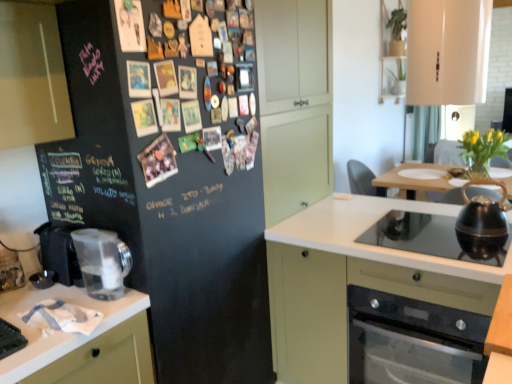
What do you see at coordinates (423, 236) in the screenshot?
I see `black glass cooktop at lower right` at bounding box center [423, 236].

Find the location of a particular element. The width and height of the screenshot is (512, 384). shiny black kettle at right, which appears as the first kitchen appliance when viewed from the right is located at coordinates (x=482, y=223).

Locate an element on the screen. This screenshot has width=512, height=384. black matte refrigerator at left is located at coordinates pos(167,191).

Image resolution: width=512 pixels, height=384 pixels. Describe the element at coordinates (167, 191) in the screenshot. I see `black matte refrigerator at left` at that location.

What do you see at coordinates (483, 148) in the screenshot? The height and width of the screenshot is (384, 512). I see `yellow matte vase at upper right` at bounding box center [483, 148].

Find the location of a particular element. wooden table at lower right is located at coordinates (500, 338).

Which object is wider, matte white cabinet at center, which appears as the second cabinetry when viewed from the top, or transparent plastic pitcher at left, marked as the first kitchen appliance in a front-to-back arrangement?

matte white cabinet at center, which appears as the second cabinetry when viewed from the top.

Is matte white cabinet at center, which appears as the second cabinetry when viewed from the top, oriented away from transparent plastic pitcher at left, marked as the first kitchen appliance in a front-to-back arrangement?

No, transparent plastic pitcher at left, marked as the first kitchen appliance in a front-to-back arrangement, is not at the back of matte white cabinet at center, which appears as the second cabinetry when viewed from the top.

From a real-world perspective, is matte white cabinet at center, which appears as the second cabinetry when viewed from the top, positioned under transparent plastic pitcher at left, the 2th kitchen appliance viewed from the right, based on gravity?

Yes.

Would you say black glass cooktop at lower right contains transparent plastic pitcher at left, the 2th kitchen appliance from the back?

No, transparent plastic pitcher at left, the 2th kitchen appliance from the back, is not a part of black glass cooktop at lower right.

From the image's perspective, is black glass cooktop at lower right located above transparent plastic pitcher at left, marked as the first kitchen appliance in a front-to-back arrangement?

Indeed, from the image's perspective, black glass cooktop at lower right is shown above transparent plastic pitcher at left, marked as the first kitchen appliance in a front-to-back arrangement.

What's the angular difference between black glass cooktop at lower right and transparent plastic pitcher at left, the 2th kitchen appliance viewed from the right,'s facing directions?

The angular difference between black glass cooktop at lower right and transparent plastic pitcher at left, the 2th kitchen appliance viewed from the right, is 1.48 degrees.

In the image, is black glass cooktop at lower right on the left side or the right side of transparent plastic pitcher at left, the 2th kitchen appliance viewed from the right?

Based on their positions, black glass cooktop at lower right is located to the right of transparent plastic pitcher at left, the 2th kitchen appliance viewed from the right.

Is yellow matte vase at upper right positioned with its back to matte white cabinet at center, which is counted as the first cabinetry, starting from the bottom?

Correct, yellow matte vase at upper right is looking away from matte white cabinet at center, which is counted as the first cabinetry, starting from the bottom.

Can you confirm if yellow matte vase at upper right is bigger than matte white cabinet at center, which appears as the second cabinetry when viewed from the top?

No, yellow matte vase at upper right is not bigger than matte white cabinet at center, which appears as the second cabinetry when viewed from the top.

Considering the positions of objects shiny black kettle at right, which appears as the first kitchen appliance when viewed from the right, and white glossy cabinet at upper right, positioned as the 1th cabinetry in top-to-bottom order, in the image provided, who is more to the left, shiny black kettle at right, which appears as the first kitchen appliance when viewed from the right, or white glossy cabinet at upper right, positioned as the 1th cabinetry in top-to-bottom order,?

Positioned to the left is white glossy cabinet at upper right, positioned as the 1th cabinetry in top-to-bottom order.

Considering the sizes of objects shiny black kettle at right, which appears as the first kitchen appliance when viewed from the right, and white glossy cabinet at upper right, positioned as the 1th cabinetry in top-to-bottom order, in the image provided, who is taller, shiny black kettle at right, which appears as the first kitchen appliance when viewed from the right, or white glossy cabinet at upper right, positioned as the 1th cabinetry in top-to-bottom order,?

Standing taller between the two is white glossy cabinet at upper right, positioned as the 1th cabinetry in top-to-bottom order.

Is shiny black kettle at right, which is the second kitchen appliance in front-to-back order, inside the boundaries of white glossy cabinet at upper right, placed as the 2th cabinetry when sorted from bottom to top, or outside?

shiny black kettle at right, which is the second kitchen appliance in front-to-back order, cannot be found inside white glossy cabinet at upper right, placed as the 2th cabinetry when sorted from bottom to top.

From a real-world perspective, is shiny black kettle at right, which appears as the first kitchen appliance when viewed from the right, positioned over white glossy cabinet at upper right, placed as the 2th cabinetry when sorted from bottom to top, based on gravity?

No, from a real-world perspective, shiny black kettle at right, which appears as the first kitchen appliance when viewed from the right, is not above white glossy cabinet at upper right, placed as the 2th cabinetry when sorted from bottom to top.

Between transparent plastic pitcher at left, marked as the first kitchen appliance in a front-to-back arrangement, and yellow matte vase at upper right, which one has smaller width?

With smaller width is transparent plastic pitcher at left, marked as the first kitchen appliance in a front-to-back arrangement.

Which is closer, (123, 257) or (488, 134)?

The point (123, 257) is in front.

Between transparent plastic pitcher at left, the 2th kitchen appliance viewed from the right, and yellow matte vase at upper right, which one has larger size?

Answer: With larger size is yellow matte vase at upper right.

Which is further, (445, 230) or (327, 231)?

The point (327, 231) is farther from the camera.

How much distance is there between black glass cooktop at lower right and matte white cabinet at center, which appears as the second cabinetry when viewed from the top?

A distance of 10.14 inches exists between black glass cooktop at lower right and matte white cabinet at center, which appears as the second cabinetry when viewed from the top.

How different are the orientations of black glass cooktop at lower right and matte white cabinet at center, which appears as the second cabinetry when viewed from the top, in degrees?

They differ by 1.06 degrees in their facing directions.

Considering the relative positions of black glass cooktop at lower right and matte white cabinet at center, which appears as the second cabinetry when viewed from the top, in the image provided, is black glass cooktop at lower right in front of matte white cabinet at center, which appears as the second cabinetry when viewed from the top,?

That is False.

Is black glass cooktop at lower right wider or thinner than black matte refrigerator at left?

In the image, black glass cooktop at lower right appears to be more narrow than black matte refrigerator at left.

Does black glass cooktop at lower right appear on the left side of black matte refrigerator at left?

Incorrect, black glass cooktop at lower right is not on the left side of black matte refrigerator at left.

Which is less distant, (364, 240) or (75, 221)?

Clearly, point (364, 240) is more distant from the camera than point (75, 221).

Image resolution: width=512 pixels, height=384 pixels. In order to click on cabinetry that is under the transparent plastic pitcher at left, the 2th kitchen appliance from the back (from a real-world perspective) in this screenshot , I will do `click(353, 281)`.

Find the location of a particular element. gas stove on the right of transparent plastic pitcher at left, the 2th kitchen appliance from the back is located at coordinates (423, 236).

When comparing their distances from transparent plastic pitcher at left, the 2th kitchen appliance viewed from the right, does black plastic coffee maker at left or shiny black kettle at right, which is the second kitchen appliance in front-to-back order, seem further?

Among the two, shiny black kettle at right, which is the second kitchen appliance in front-to-back order, is located further to transparent plastic pitcher at left, the 2th kitchen appliance viewed from the right.

Looking at this image, based on their spatial positions, is white glossy cabinet at upper right, placed as the 2th cabinetry when sorted from bottom to top, or black matte refrigerator at left closer to transparent plastic pitcher at left, marked as the first kitchen appliance in a front-to-back arrangement?

Based on the image, black matte refrigerator at left appears to be nearer to transparent plastic pitcher at left, marked as the first kitchen appliance in a front-to-back arrangement.

Which object lies further to the anchor point shiny black kettle at right, which ranks as the second kitchen appliance in left-to-right order, white glossy cabinet at upper right, placed as the 2th cabinetry when sorted from bottom to top, or transparent plastic pitcher at left, marked as the first kitchen appliance in a front-to-back arrangement?

Among the two, transparent plastic pitcher at left, marked as the first kitchen appliance in a front-to-back arrangement, is located further to shiny black kettle at right, which ranks as the second kitchen appliance in left-to-right order.

Based on their spatial positions, is wooden table at lower right or yellow matte vase at upper right further from black glass stove at lower right?

Among the two, yellow matte vase at upper right is located further to black glass stove at lower right.

When comparing their distances from black glass cooktop at lower right, does shiny black kettle at right, which appears as the first kitchen appliance when viewed from the right, or yellow matte vase at upper right seem closer?

Among the two, shiny black kettle at right, which appears as the first kitchen appliance when viewed from the right, is located nearer to black glass cooktop at lower right.

When comparing their distances from black glass cooktop at lower right, does black glass stove at lower right or matte white cabinet at center, which appears as the second cabinetry when viewed from the top, seem closer?

matte white cabinet at center, which appears as the second cabinetry when viewed from the top.

When comparing their distances from black matte refrigerator at left, does matte white cabinet at center, which appears as the second cabinetry when viewed from the top, or black glass stove at lower right seem further?

Among the two, black glass stove at lower right is located further to black matte refrigerator at left.

Estimate the real-world distances between objects in this image. Which object is further from black plastic coffee maker at left, transparent plastic pitcher at left, marked as the first kitchen appliance in a front-to-back arrangement, or yellow matte vase at upper right?

yellow matte vase at upper right.

Where is `kitchen appliance situated between black plastic coffee maker at left and matte white cabinet at center, which appears as the second cabinetry when viewed from the top, from left to right`? kitchen appliance situated between black plastic coffee maker at left and matte white cabinet at center, which appears as the second cabinetry when viewed from the top, from left to right is located at coordinates (102, 262).

Where is `refrigerator situated between black plastic coffee maker at left and white glossy cabinet at upper right, placed as the 2th cabinetry when sorted from bottom to top, from left to right`? Image resolution: width=512 pixels, height=384 pixels. refrigerator situated between black plastic coffee maker at left and white glossy cabinet at upper right, placed as the 2th cabinetry when sorted from bottom to top, from left to right is located at coordinates (167, 191).

Where is `home appliance situated between black plastic coffee maker at left and wooden table at lower right from left to right`? This screenshot has height=384, width=512. home appliance situated between black plastic coffee maker at left and wooden table at lower right from left to right is located at coordinates (413, 341).

Identify the location of gas stove situated between black plastic coffee maker at left and yellow matte vase at upper right from left to right. (423, 236).